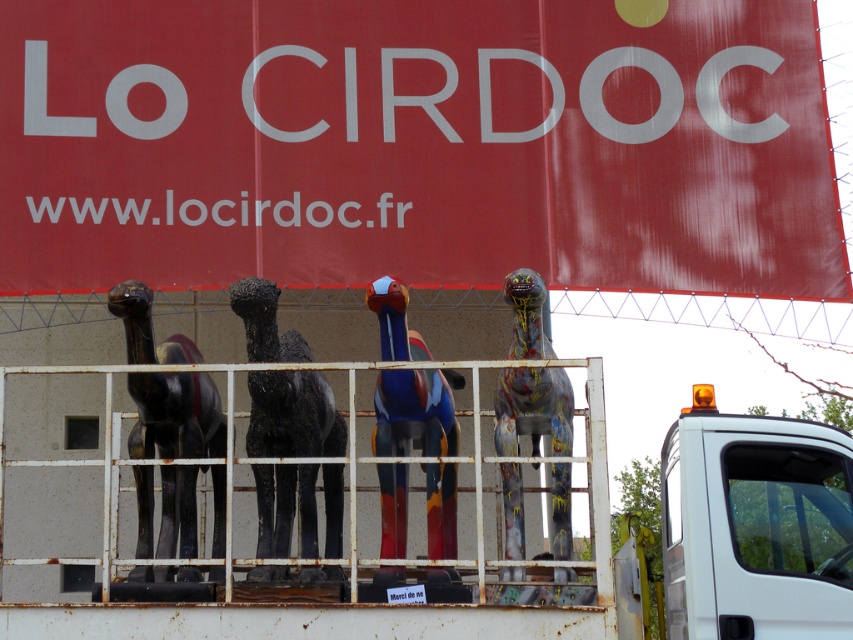
Which is behind, point (712, 440) or point (401, 340)?

The point (401, 340) is behind.

Is point (701, 618) positioned in front of point (450, 465)?

That is True.

Locate an element on the screen. white plastic truck at lower right is located at coordinates (756, 528).

Is point (444, 444) less distant than point (514, 339)?

Yes, point (444, 444) is in front of point (514, 339).

Is painted wood bird at center closer to the viewer compared to painted wood dinosaur at center?

No, it is not.

Does point (396, 280) lie behind point (509, 396)?

No, (396, 280) is in front of (509, 396).

Image resolution: width=853 pixels, height=640 pixels. In order to click on painted wood bird at center in this screenshot , I will do `click(415, 412)`.

Can you confirm if black matte horse at center is positioned below shiny black camel at left?

Actually, black matte horse at center is above shiny black camel at left.

Who is more distant from viewer, (264, 524) or (212, 452)?

The point (212, 452) is more distant.

Locate an element on the screen. The width and height of the screenshot is (853, 640). black matte horse at center is located at coordinates (293, 416).